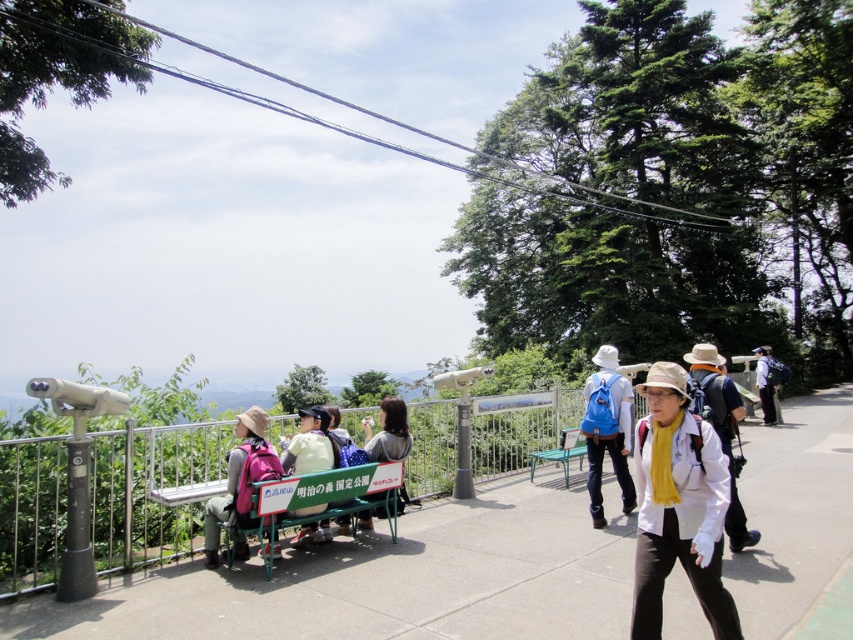
From the picture: You are standing at the viewpoint and want to take a photo of the point at coordinates point (732, 524). If your camera has a focal length of 50mm and you are 18.68 feet away from the point, what is the approximate angle of view needed to capture the point in the frame?

The point at coordinates point (732, 524) is 18.68 feet away from the viewer. To calculate the angle of view, use the formula angle of view in degrees equals arctangent of object distance divided by focal length. Plugging in the values, the angle of view would be approximately arctangent of 18.68 divided by 50, which is about 20.7 degrees.